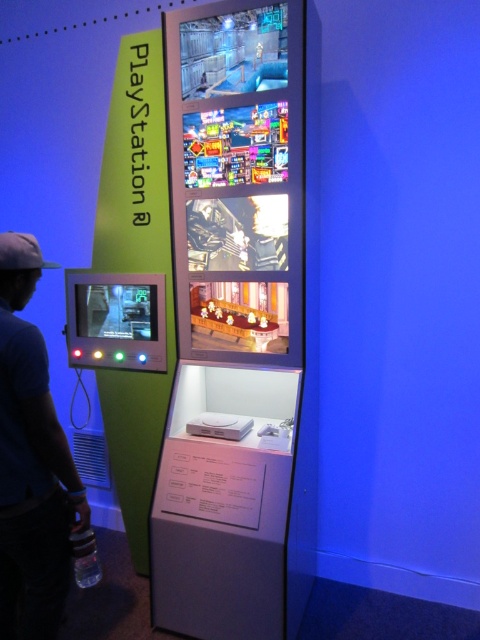
Question: Is blue cotton t-shirt at left thinner than black fabric baseball hat at left?

Choices:
 (A) yes
 (B) no

Answer: (B)

Question: Does black fabric baseball hat at left lie in front of clear plastic bottle at lower left?

Choices:
 (A) yes
 (B) no

Answer: (A)

Question: Which of the following is the closest to the observer?

Choices:
 (A) blue cotton t-shirt at left
 (B) clear plastic bottle at lower left
 (C) black fabric baseball hat at left

Answer: (A)

Question: Which is nearer to the clear plastic bottle at lower left?

Choices:
 (A) blue cotton t-shirt at left
 (B) black fabric baseball hat at left

Answer: (A)

Question: Where is black fabric baseball hat at left located in relation to clear plastic bottle at lower left in the image?

Choices:
 (A) above
 (B) below

Answer: (A)

Question: Which object is closer to the camera taking this photo?

Choices:
 (A) black fabric baseball hat at left
 (B) clear plastic bottle at lower left

Answer: (A)